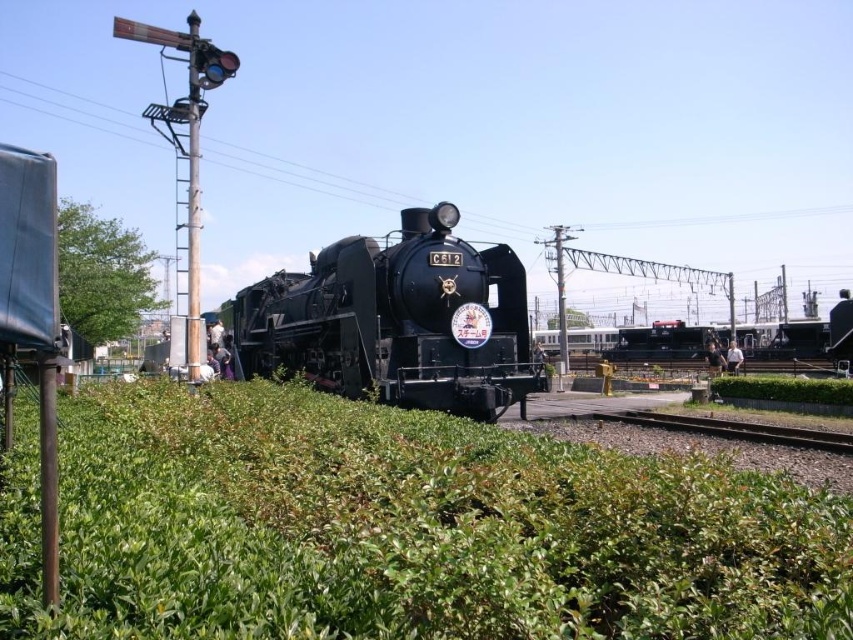
Who is more forward, (378, 298) or (772, 426)?

Point (378, 298)

Does black polished steam engine at center appear over brown gravel train track at lower center?

Yes, black polished steam engine at center is above brown gravel train track at lower center.

Based on the photo, who is more distant from viewer, (x=454, y=381) or (x=718, y=419)?

Point (x=718, y=419)

Find the location of `black polished steam engine at center`. black polished steam engine at center is located at coordinates (397, 321).

Is green leafy hedge at center above black polished steam engine at center?

Actually, green leafy hedge at center is below black polished steam engine at center.

Is green leafy hedge at center positioned in front of black polished steam engine at center?

Yes, green leafy hedge at center is in front of black polished steam engine at center.

Who is more distant from viewer, [606,598] or [424,253]?

The point [424,253] is more distant.

Image resolution: width=853 pixels, height=640 pixels. I want to click on green leafy hedge at center, so click(x=401, y=529).

Looking at this image, measure the distance between green leafy hedge at center and camera.

green leafy hedge at center is 4.26 meters from camera.

What do you see at coordinates (401, 529) in the screenshot?
I see `green leafy hedge at center` at bounding box center [401, 529].

The image size is (853, 640). What are the coordinates of `green leafy hedge at center` in the screenshot? It's located at (401, 529).

The image size is (853, 640). Find the location of `green leafy hedge at center`. green leafy hedge at center is located at coordinates (401, 529).